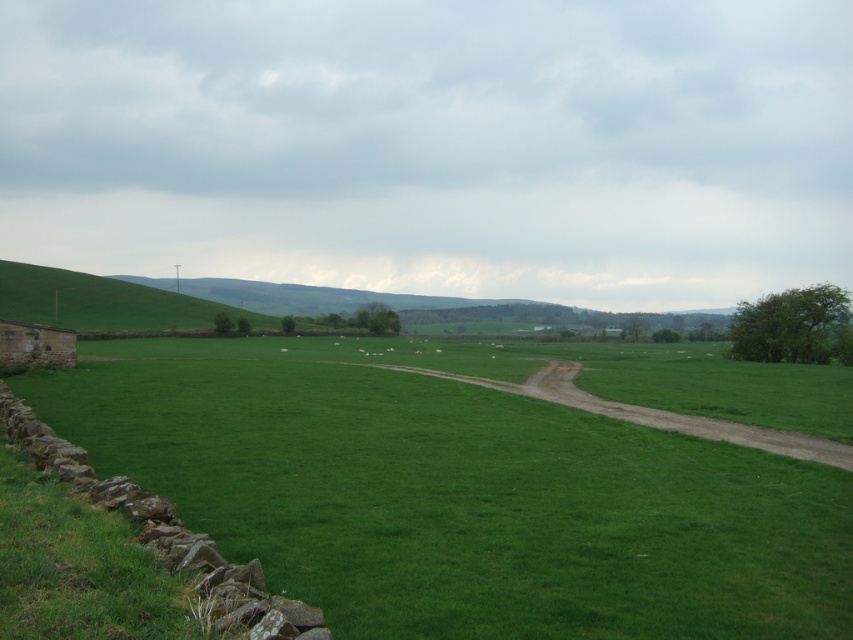
Question: Can you confirm if green grassy field at left is positioned to the left of dusty brown dirt track at center-right?

Choices:
 (A) yes
 (B) no

Answer: (A)

Question: Does green grassy field at left come in front of dusty brown dirt track at center-right?

Choices:
 (A) yes
 (B) no

Answer: (A)

Question: Which point appears farthest from the camera in this image?

Choices:
 (A) (585, 396)
 (B) (378, 493)

Answer: (A)

Question: From the image, what is the correct spatial relationship of green grassy field at left in relation to dusty brown dirt track at center-right?

Choices:
 (A) above
 (B) below

Answer: (A)